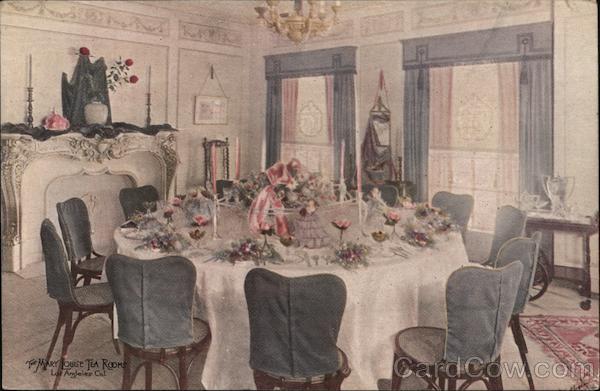
At what (x,y) coordinates should I click in order to perform the action: click on chandelier. Please return your answer as a coordinate pair (x, y). Looking at the image, I should click on (301, 25).